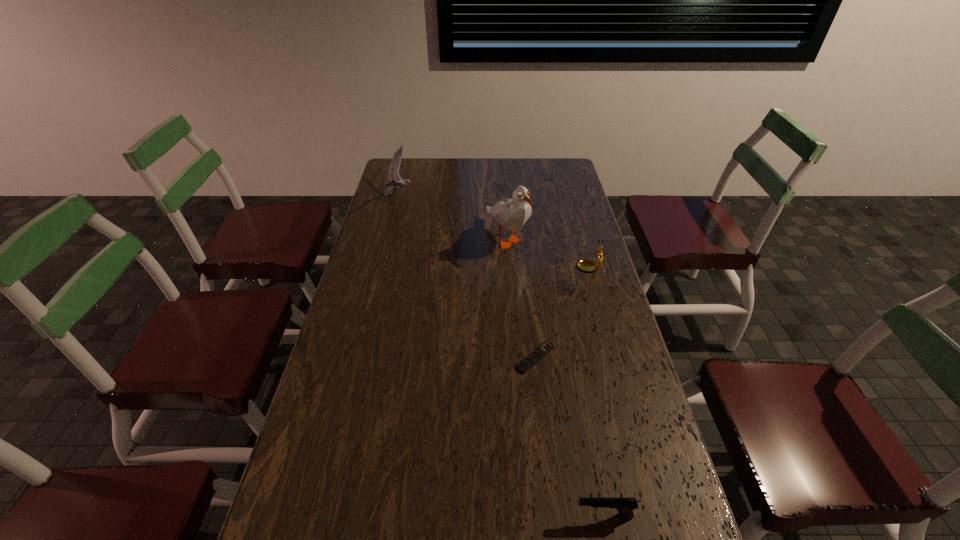
This screenshot has width=960, height=540. I want to click on object that is the closest to the left gull, so click(512, 213).

Locate an element on the screen. The height and width of the screenshot is (540, 960). free spot that satisfies the following two spatial constraints: 1. at the beak of the right gull; 2. on the right side of the remote control is located at coordinates (516, 357).

Locate an element on the screen. The height and width of the screenshot is (540, 960). vacant area in the image that satisfies the following two spatial constraints: 1. at the tip of the beak of the shortest object; 2. on the left side of the fourth shortest object is located at coordinates (358, 357).

Locate an element on the screen. vacant space that satisfies the following two spatial constraints: 1. at the tip of the beak of the shorter gull; 2. on the right side of the second nearest object is located at coordinates (358, 357).

The height and width of the screenshot is (540, 960). I want to click on vacant region that satisfies the following two spatial constraints: 1. at the beak of the remote control; 2. on the right side of the tallest object, so click(x=516, y=357).

Find the location of a particular element. This screenshot has width=960, height=540. free space that satisfies the following two spatial constraints: 1. at the tip of the beak of the leftmost object; 2. on the back side of the shortest object is located at coordinates (358, 357).

The width and height of the screenshot is (960, 540). Identify the location of blank area in the image that satisfies the following two spatial constraints: 1. at the tip of the beak of the left gull; 2. on the right side of the remote control. (358, 357).